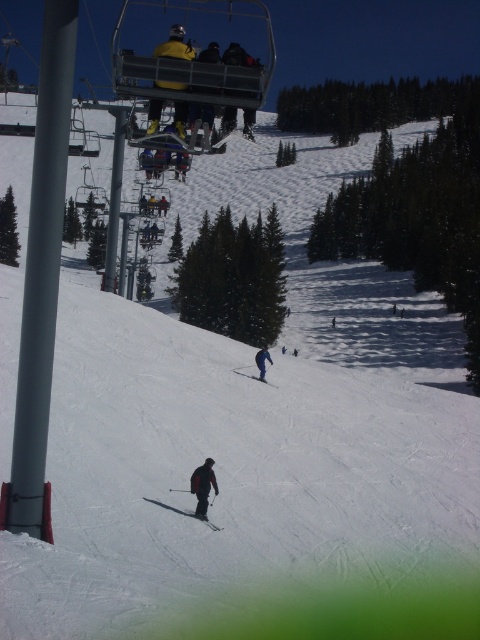
Is blue fabric pants at lower center positioned at the back of matte blue ski at center?

Yes, blue fabric pants at lower center is behind matte blue ski at center.

Between point (255, 360) and point (273, 387), which one is positioned behind?

Positioned behind is point (255, 360).

This screenshot has height=640, width=480. In order to click on blue fabric pants at lower center in this screenshot , I will do coord(263,362).

Which is above, dark gray ski suit at lower center or matte blue ski at center?

matte blue ski at center

Who is shorter, dark gray ski suit at lower center or matte blue ski at center?

matte blue ski at center

Image resolution: width=480 pixels, height=640 pixels. What do you see at coordinates (203, 486) in the screenshot? I see `dark gray ski suit at lower center` at bounding box center [203, 486].

Locate an element on the screen. dark gray ski suit at lower center is located at coordinates (203, 486).

In the scene shown: Which of these two, yellow fabric jacket at upper center or dark gray ski suit at lower center, stands taller?

yellow fabric jacket at upper center is taller.

Which is in front, point (163, 83) or point (203, 465)?

Positioned in front is point (163, 83).

This screenshot has width=480, height=640. What are the coordinates of `yellow fabric jacket at upper center` in the screenshot? It's located at (175, 45).